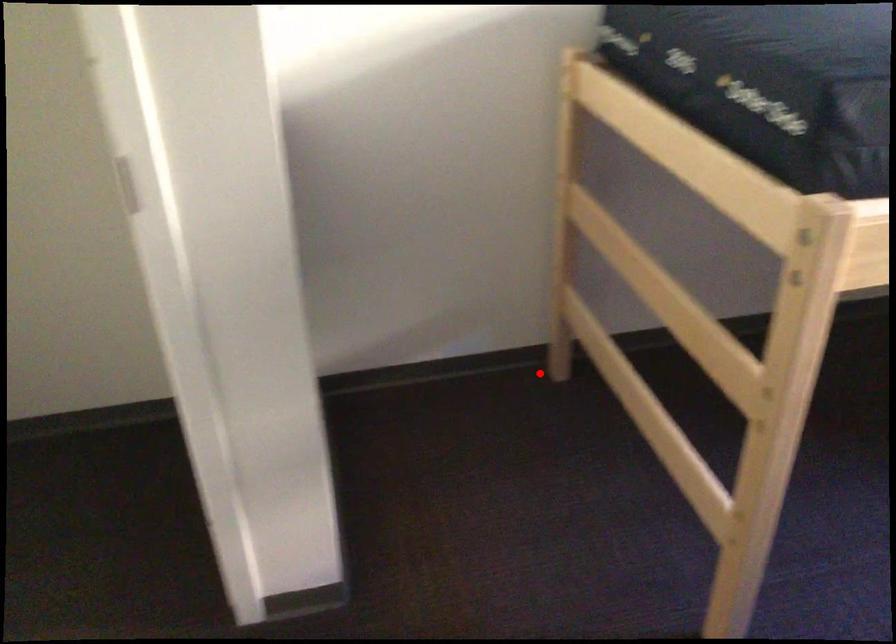
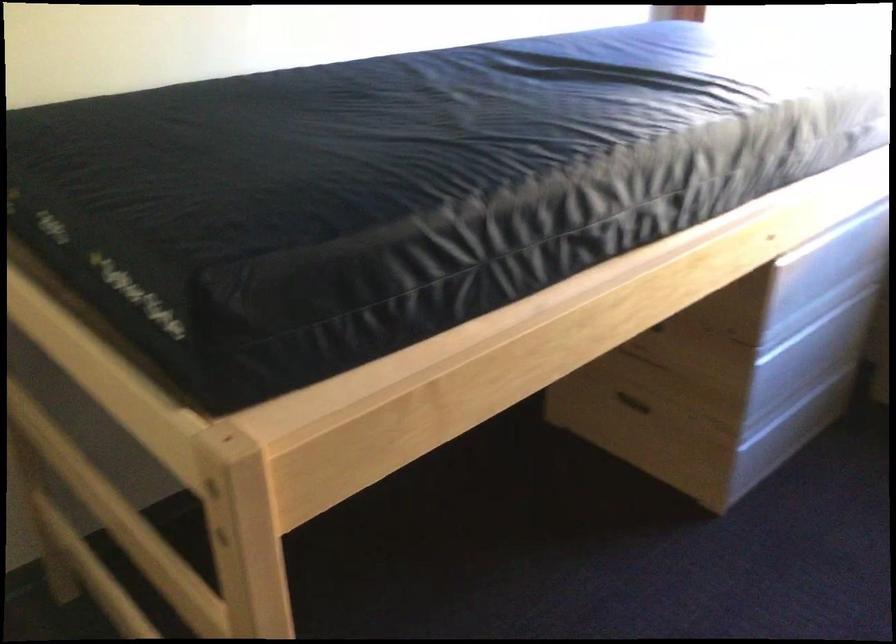
Question: I am providing you with two images of the same scene from different viewpoints. A red point is shown in image1. For the corresponding object point in image2, is it positioned nearer or farther from the camera?

Choices:
 (A) Nearer
 (B) Farther

Answer: (A)